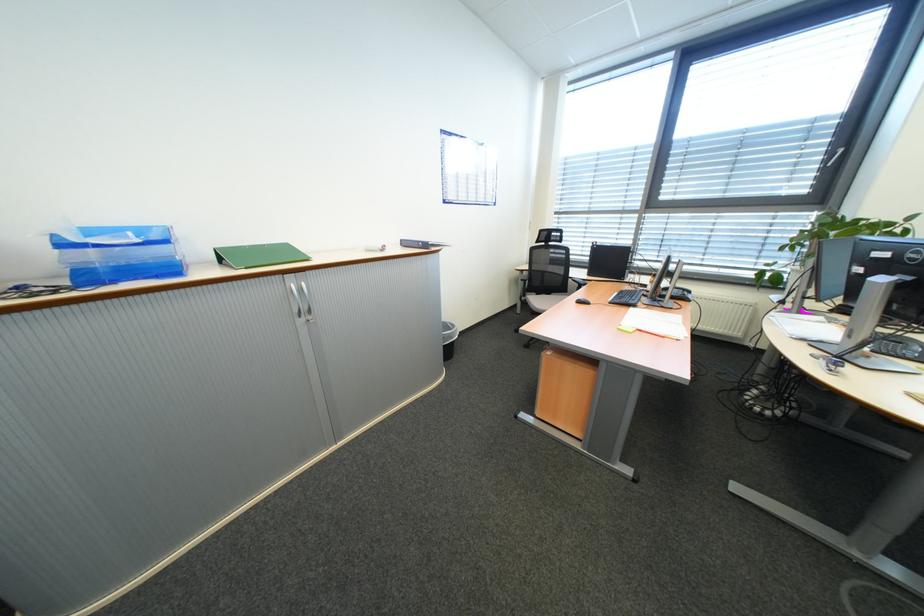
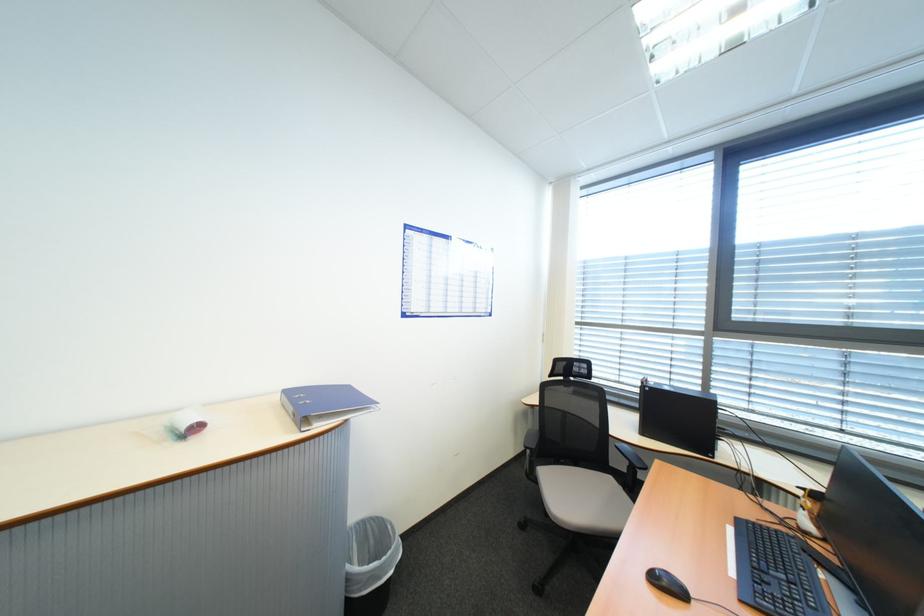
Which direction would the cameraman need to move to produce the second image?

The cameraman walked toward right, forward.